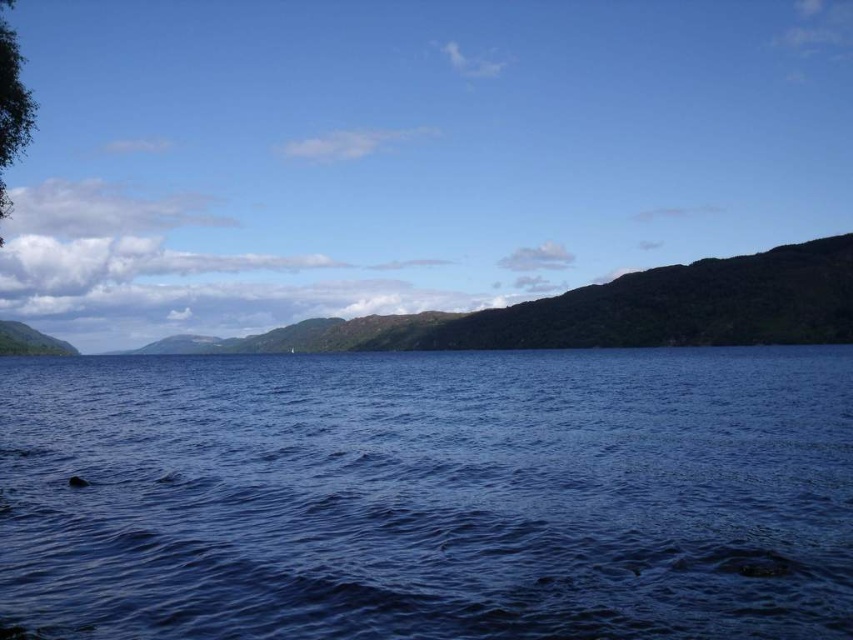
Question: Among these objects, which one is nearest to the camera?

Choices:
 (A) blue liquid water at center
 (B) green textured hillside at center

Answer: (A)

Question: Which object is positioned farthest from the blue liquid water at center?

Choices:
 (A) green textured hillside at center
 (B) green leafy tree at upper left

Answer: (A)

Question: In this image, where is blue liquid water at center located relative to green textured hillside at center?

Choices:
 (A) right
 (B) left

Answer: (A)

Question: Among these points, which one is nearest to the camera?

Choices:
 (A) (605, 636)
 (B) (758, 260)

Answer: (A)

Question: Is the position of blue liquid water at center less distant than that of green leafy tree at upper left?

Choices:
 (A) yes
 (B) no

Answer: (A)

Question: Can you confirm if blue liquid water at center is positioned below green leafy tree at upper left?

Choices:
 (A) yes
 (B) no

Answer: (A)